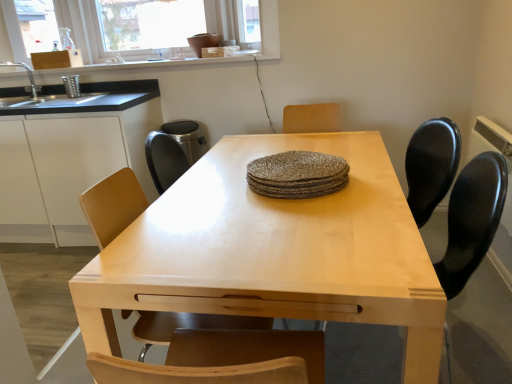
Where is `vacant area on top of black granite countertop at left (from a real-world perspective)`? vacant area on top of black granite countertop at left (from a real-world perspective) is located at coordinates 67,86.